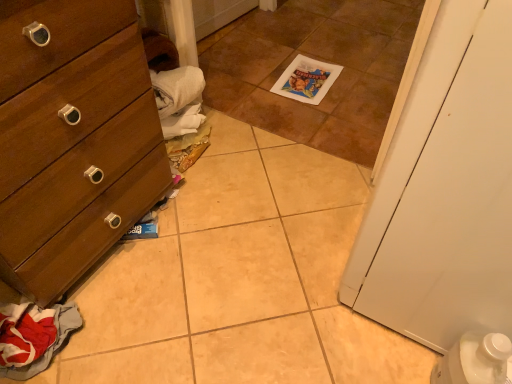
Question: In terms of width, does brown tile at center look wider or thinner when compared to wooden dresser at left?

Choices:
 (A) wide
 (B) thin

Answer: (A)

Question: Is brown tile at center bigger or smaller than wooden dresser at left?

Choices:
 (A) small
 (B) big

Answer: (A)

Question: Which object is positioned closest to the wooden dresser at left?

Choices:
 (A) white matte door at right
 (B) red fabric clothes at lower left
 (C) brown tile at center

Answer: (B)

Question: Which is nearer to the red fabric clothes at lower left?

Choices:
 (A) brown tile at center
 (B) wooden dresser at left
 (C) white matte door at right

Answer: (B)